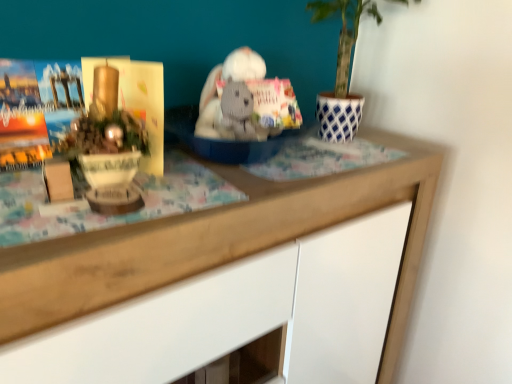
Question: Does white knitted bear at center have a greater width compared to wooden desk at center?

Choices:
 (A) no
 (B) yes

Answer: (A)

Question: Is white knitted bear at center to the left of wooden desk at center from the viewer's perspective?

Choices:
 (A) no
 (B) yes

Answer: (A)

Question: Is white knitted bear at center positioned behind wooden desk at center?

Choices:
 (A) yes
 (B) no

Answer: (A)

Question: Would you say wooden desk at center is part of white knitted bear at center's contents?

Choices:
 (A) yes
 (B) no

Answer: (B)

Question: Is white knitted bear at center thinner than wooden desk at center?

Choices:
 (A) yes
 (B) no

Answer: (A)

Question: From a real-world perspective, is matte gold paperback book at left positioned above or below wooden desk at center?

Choices:
 (A) above
 (B) below

Answer: (A)

Question: In the image, is matte gold paperback book at left on the left side or the right side of wooden desk at center?

Choices:
 (A) right
 (B) left

Answer: (B)

Question: Is point (92, 71) positioned closer to the camera than point (46, 281)?

Choices:
 (A) farther
 (B) closer

Answer: (A)

Question: Is matte gold paperback book at left inside or outside of wooden desk at center?

Choices:
 (A) inside
 (B) outside

Answer: (B)

Question: Visually, is white knitted bear at center positioned to the left or to the right of wooden desk at center?

Choices:
 (A) left
 (B) right

Answer: (B)

Question: Is white knitted bear at center spatially inside wooden desk at center, or outside of it?

Choices:
 (A) outside
 (B) inside

Answer: (A)

Question: Is white knitted bear at center bigger or smaller than wooden desk at center?

Choices:
 (A) big
 (B) small

Answer: (B)

Question: Considering their positions, is white knitted bear at center located in front of or behind wooden desk at center?

Choices:
 (A) behind
 (B) front

Answer: (A)

Question: From a real-world perspective, relative to matte gold paperback book at left, is wooden desk at center vertically above or below?

Choices:
 (A) below
 (B) above

Answer: (A)

Question: Is wooden desk at center bigger or smaller than matte gold paperback book at left?

Choices:
 (A) small
 (B) big

Answer: (B)